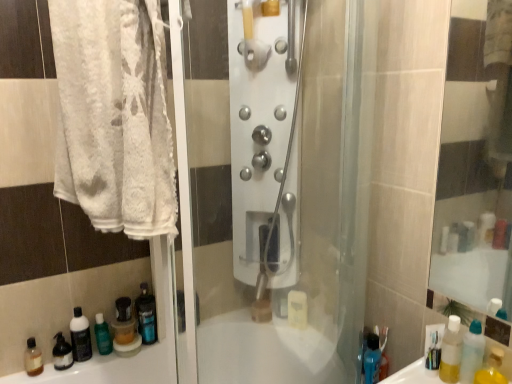
Question: Does translucent plastic mouthwash at lower left, the 3th mouthwash when ordered from left to right, have a lesser height compared to yellow translucent bottle at lower right, the 1th mouthwash in the front-to-back sequence?

Choices:
 (A) no
 (B) yes

Answer: (A)

Question: Does translucent plastic mouthwash at lower left, arranged as the 1th mouthwash when viewed from the back, lie in front of yellow translucent bottle at lower right, the first mouthwash viewed from the right?

Choices:
 (A) yes
 (B) no

Answer: (B)

Question: From the image's perspective, is translucent plastic mouthwash at lower left, marked as the third mouthwash in a right-to-left arrangement, located beneath yellow translucent bottle at lower right, the fifth mouthwash when ordered from back to front?

Choices:
 (A) no
 (B) yes

Answer: (B)

Question: Is translucent plastic mouthwash at lower left, arranged as the 1th mouthwash when viewed from the back, next to yellow translucent bottle at lower right, the first mouthwash viewed from the right, and touching it?

Choices:
 (A) yes
 (B) no

Answer: (B)

Question: Could you tell me if translucent plastic mouthwash at lower left, marked as the third mouthwash in a right-to-left arrangement, is turned towards yellow translucent bottle at lower right, the 1th mouthwash in the front-to-back sequence?

Choices:
 (A) no
 (B) yes

Answer: (A)

Question: Is translucent plastic mouthwash at lower left, the 3th mouthwash when ordered from left to right, behind yellow translucent bottle at lower right, the first mouthwash viewed from the right?

Choices:
 (A) no
 (B) yes

Answer: (B)

Question: Is translucent plastic bottle at lower left, the first bottle when ordered from left to right, to the left of satin nickel shower controls at center from the viewer's perspective?

Choices:
 (A) no
 (B) yes

Answer: (B)

Question: From the image's perspective, would you say translucent plastic bottle at lower left, arranged as the 3th bottle when viewed from the right, is positioned over satin nickel shower controls at center?

Choices:
 (A) no
 (B) yes

Answer: (A)

Question: Does translucent plastic bottle at lower left, the first bottle when ordered from left to right, have a lesser height compared to satin nickel shower controls at center?

Choices:
 (A) yes
 (B) no

Answer: (A)

Question: Is translucent plastic bottle at lower left, the first bottle when ordered from left to right, facing away from satin nickel shower controls at center?

Choices:
 (A) no
 (B) yes

Answer: (A)

Question: Can you confirm if translucent plastic bottle at lower left, the 3th bottle from the front, is wider than satin nickel shower controls at center?

Choices:
 (A) no
 (B) yes

Answer: (A)

Question: Is translucent plastic bottle at lower left, the first bottle when ordered from left to right, aimed at satin nickel shower controls at center?

Choices:
 (A) no
 (B) yes

Answer: (A)

Question: Is green matte bottle at lower left completely or partially outside of blue translucent bottle at lower right, positioned as the 2th bottle in left-to-right order?

Choices:
 (A) yes
 (B) no

Answer: (A)